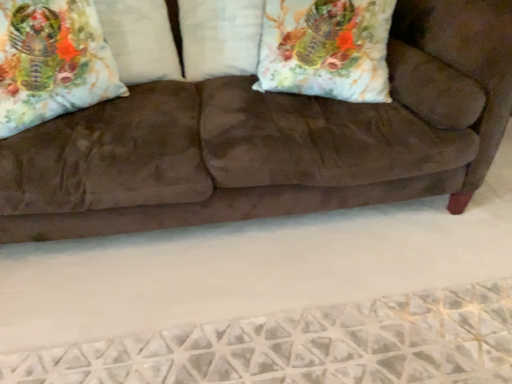
Question: Considering the positions of floral fabric pillow at upper left, placed as the 1th pillow when sorted from left to right, and brown suede couch at center in the image, is floral fabric pillow at upper left, placed as the 1th pillow when sorted from left to right, wider or thinner than brown suede couch at center?

Choices:
 (A) wide
 (B) thin

Answer: (B)

Question: From the image's perspective, is floral fabric pillow at upper left, placed as the 1th pillow when sorted from left to right, located above or below brown suede couch at center?

Choices:
 (A) below
 (B) above

Answer: (B)

Question: Based on their relative distances, which object is nearer to the floral fabric pillow at upper left, the second pillow in the right-to-left sequence?

Choices:
 (A) brown suede couch at center
 (B) satin white pillow at center, marked as the second pillow in a left-to-right arrangement
 (C) floral fabric pillow at upper left, the 2th throw pillow in the right-to-left sequence
 (D) floral fabric pillow at upper right, positioned as the second throw pillow in left-to-right order

Answer: (B)

Question: Estimate the real-world distances between objects in this image. Which object is farther from the brown suede couch at center?

Choices:
 (A) floral fabric pillow at upper right, which is the first throw pillow from right to left
 (B) floral fabric pillow at upper left, which appears as the first throw pillow when viewed from the left
 (C) satin white pillow at center, marked as the first pillow in a right-to-left arrangement
 (D) floral fabric pillow at upper left, placed as the 1th pillow when sorted from left to right

Answer: (D)